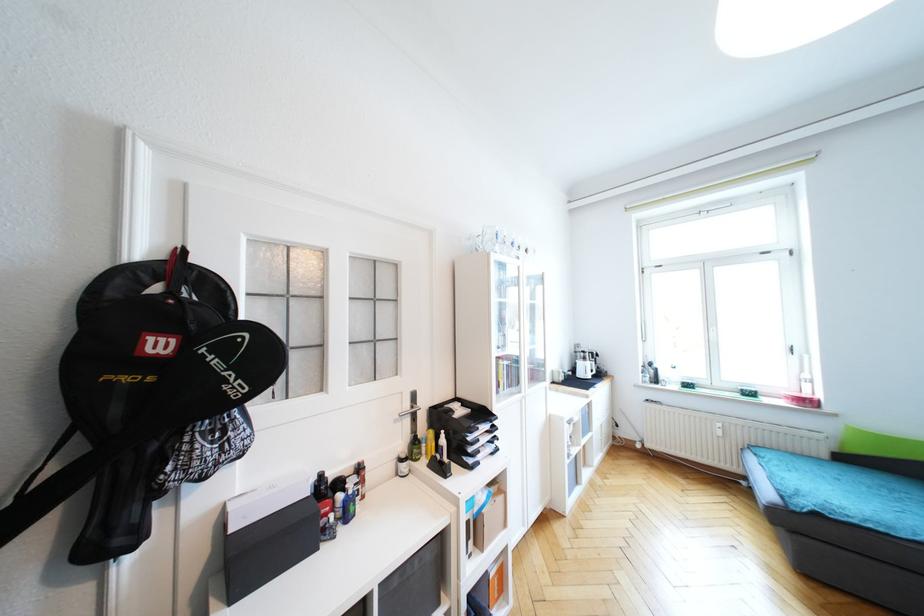
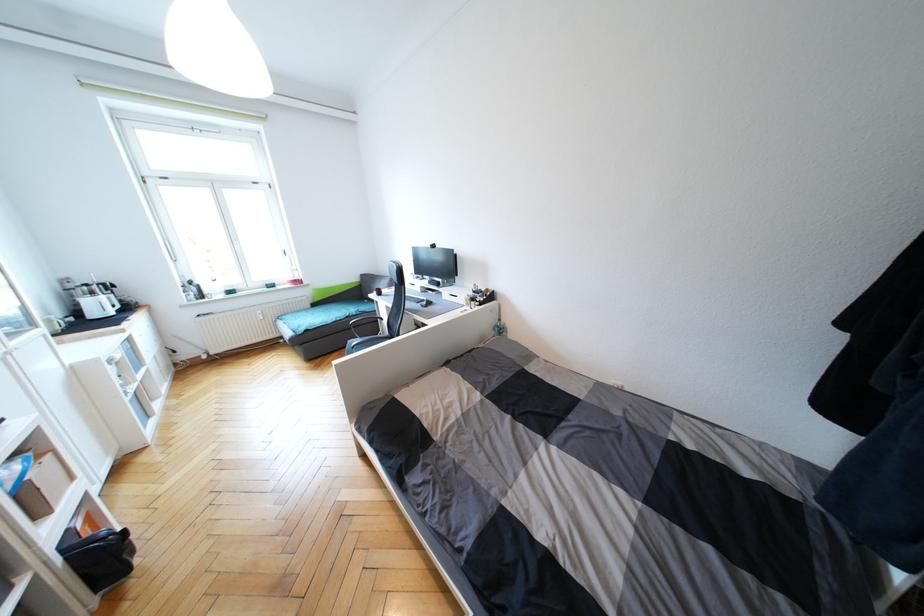
The point at (848, 460) is marked in the first image. Where is the corresponding point in the second image?

(319, 306)